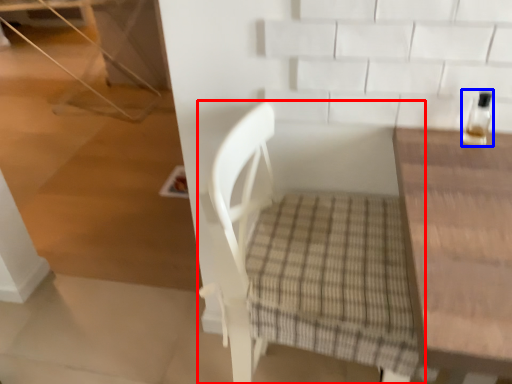
Question: Which object appears farthest to the camera in this image, chair (highlighted by a red box) or bottle (highlighted by a blue box)?

Choices:
 (A) chair
 (B) bottle

Answer: (B)